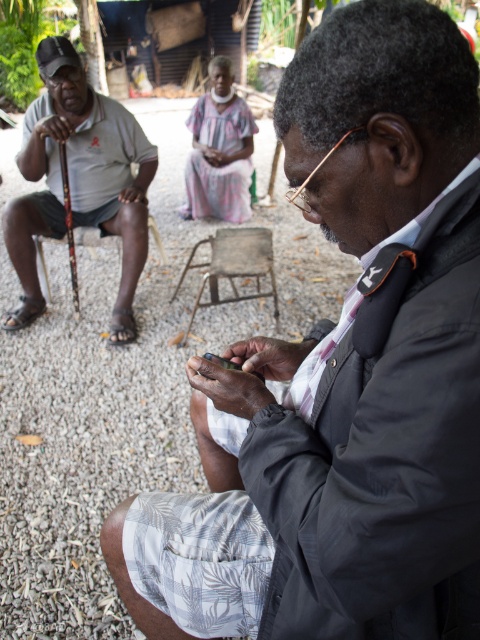
You are a photographer standing near the metallic stool at center and the wooden cane at left. You need to place a small tripod between them. According to the scene, where should you position the tripod so it is between the two objects?

The metallic stool at center is located below the wooden cane at left, so you should place the tripod between them by positioning it horizontally between the metallic stool at center and the wooden cane at left, ensuring it is in the middle of their vertical alignment.